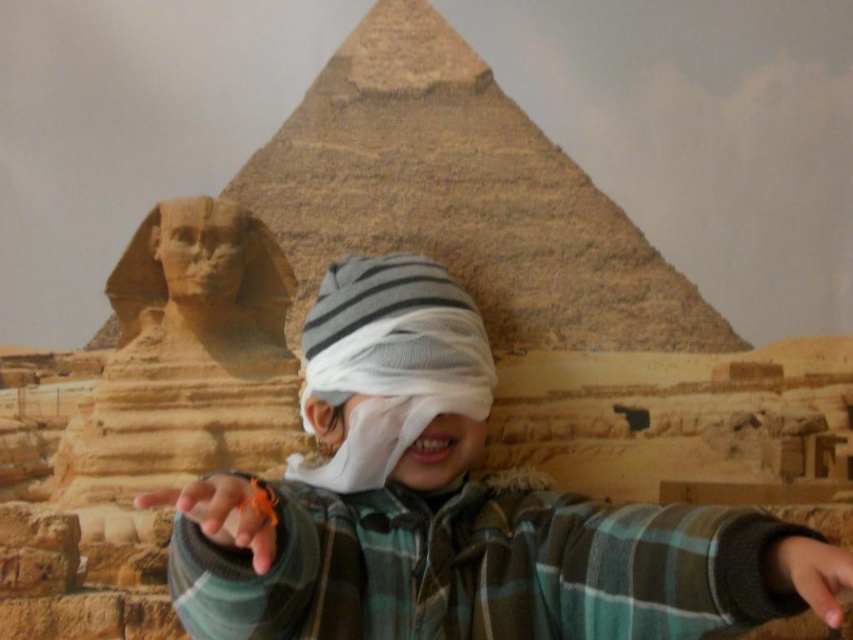
Does striped knit hat at center have a lesser height compared to smooth skin hand at lower right?

Incorrect, striped knit hat at center's height does not fall short of smooth skin hand at lower right's.

I want to click on striped knit hat at center, so click(440, 506).

Between point (550, 524) and point (206, 516), which one is positioned behind?

Point (550, 524)

Measure the distance from striped knit hat at center to orange string at center.

striped knit hat at center and orange string at center are 5.52 meters apart from each other.

At what (x,y) coordinates should I click in order to perform the action: click on striped knit hat at center. Please return your answer as a coordinate pair (x, y). Image resolution: width=853 pixels, height=640 pixels. Looking at the image, I should click on [440, 506].

Does orange string at center have a greater height compared to smooth skin hand at lower right?

No.

Can you confirm if orange string at center is smaller than smooth skin hand at lower right?

No, orange string at center is not smaller than smooth skin hand at lower right.

Which is in front, point (257, 499) or point (810, 602)?

Point (810, 602)

Find the location of a particular element. This screenshot has height=640, width=853. orange string at center is located at coordinates (225, 513).